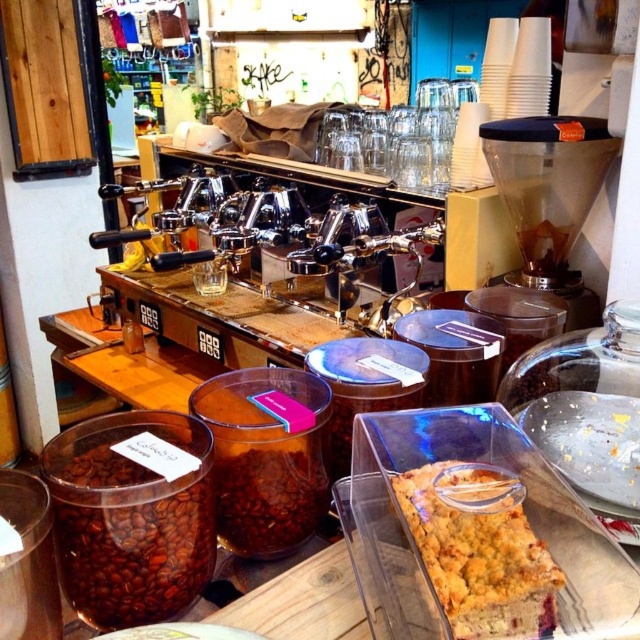
Question: Can you confirm if dark brown matte coffee beans at lower left is positioned to the left of yellow crumbly cake at lower right?

Choices:
 (A) no
 (B) yes

Answer: (B)

Question: Which object appears closest to the camera in this image?

Choices:
 (A) dark brown matte coffee beans at lower left
 (B) yellow crumbly cake at lower right

Answer: (B)

Question: Does dark brown matte coffee beans at lower left have a larger size compared to yellow crumbly cake at lower right?

Choices:
 (A) no
 (B) yes

Answer: (B)

Question: Is dark brown matte coffee beans at lower left smaller than yellow crumbly cake at lower right?

Choices:
 (A) yes
 (B) no

Answer: (B)